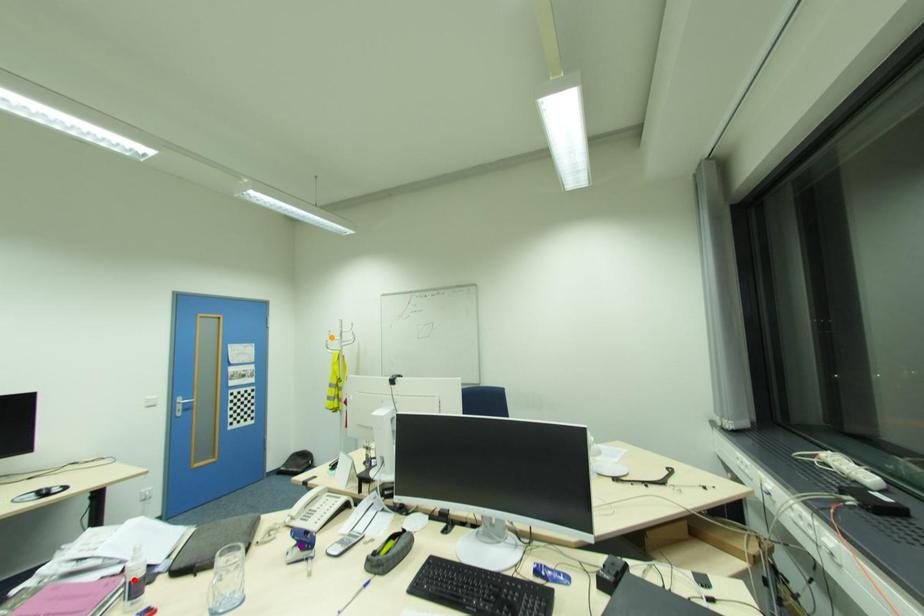
Consider the image. Order these from nearest to farthest:
orange point | purple point | red point

red point → purple point → orange point